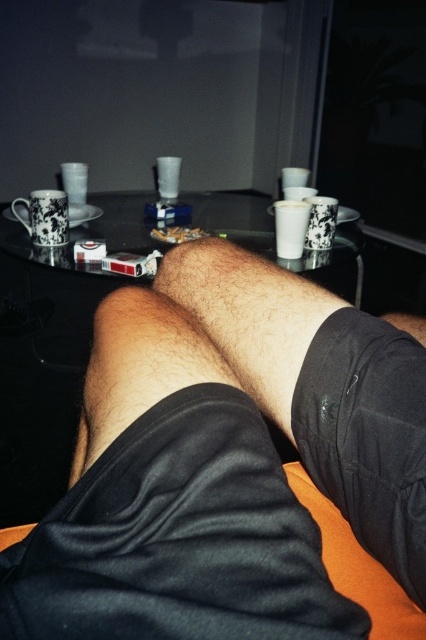
From the picture: You are a delivery robot that needs to place a package on the transparent glass table at center. The robot is 50 centimeters wide. Can you move around the black cotton leg at center to reach the table?

The distance between the black cotton leg at center and transparent glass table at center is 87.65 centimeters. Since the robot is 50 centimeters wide, it can easily navigate the space between them to reach the table.